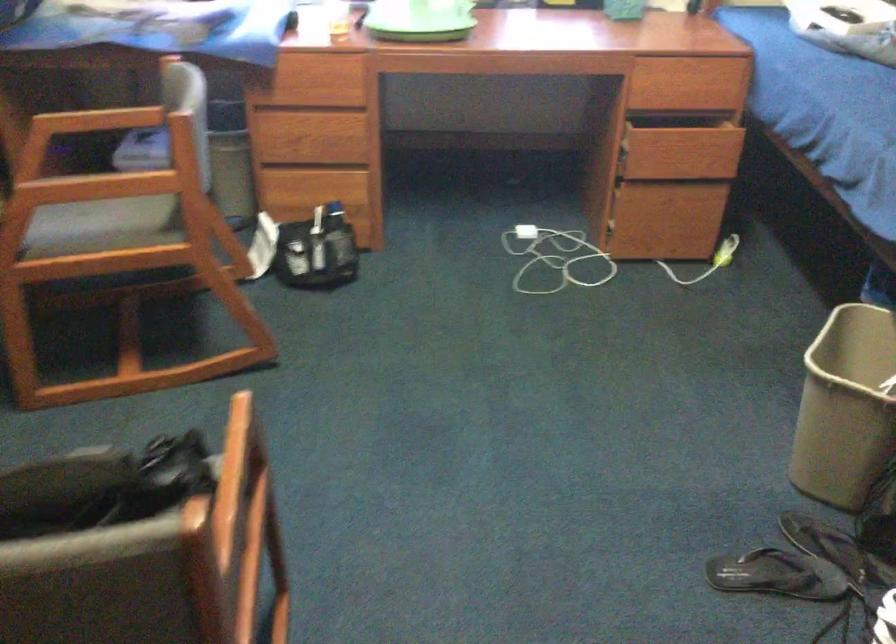
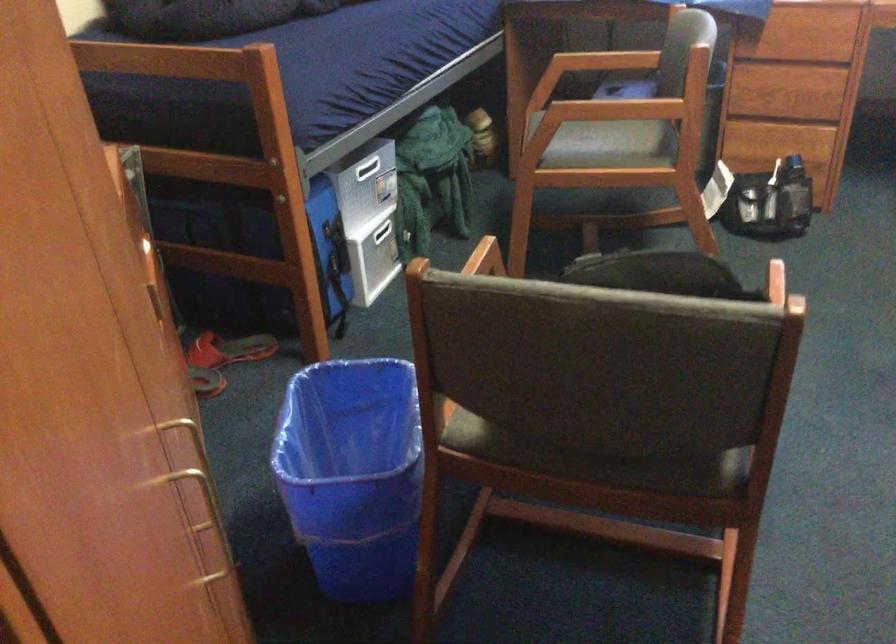
Locate, in the second image, the point that corresponds to [108,462] in the first image.

(659, 272)